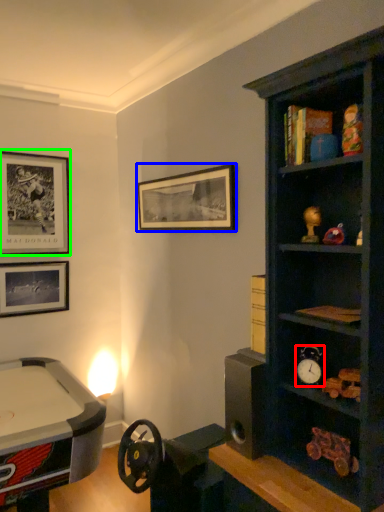
Question: Considering the real-world distances, which object is closest to clock (highlighted by a red box)? picture frame (highlighted by a blue box) or picture frame (highlighted by a green box).

Choices:
 (A) picture frame
 (B) picture frame

Answer: (A)